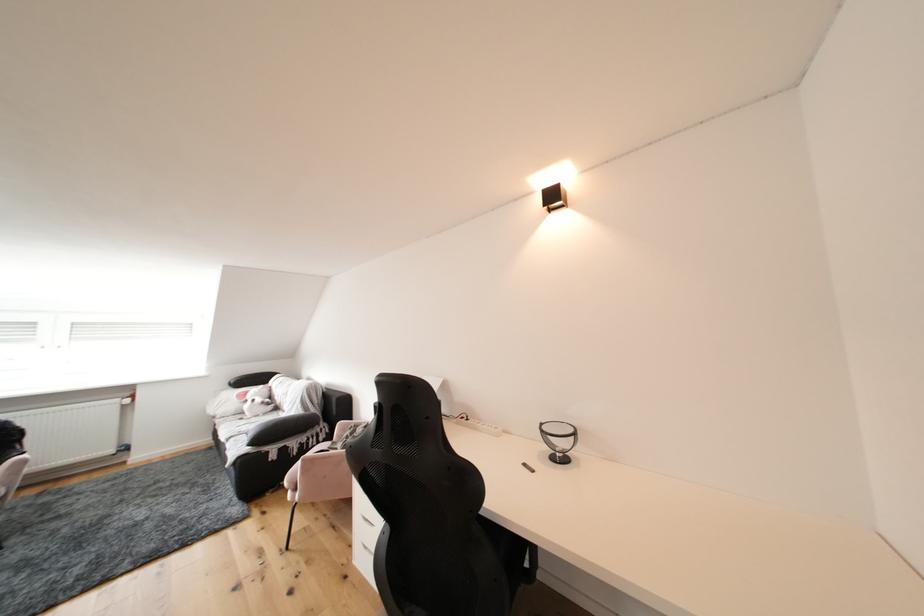
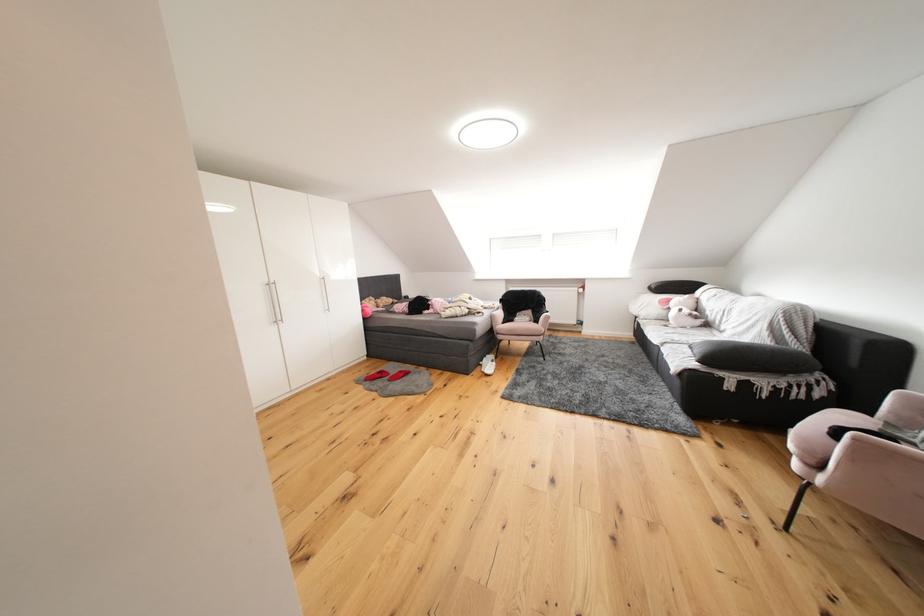
Question: Based on the continuous images, in which direction is the camera rotating? Reply with the corresponding letter.

Choices:
 (A) Left
 (B) Right
 (C) Up
 (D) Down

Answer: (A)